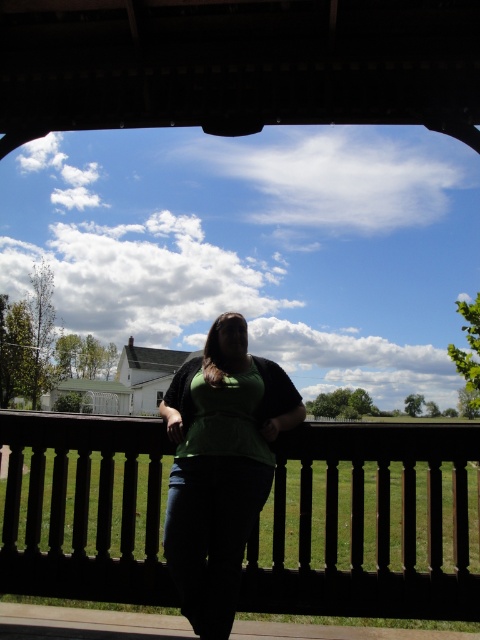
Is dark brown wooden porch at center above green matte shirt at center?

Incorrect, dark brown wooden porch at center is not positioned above green matte shirt at center.

Between dark brown wooden porch at center and green matte shirt at center, which one has more height?

With more height is green matte shirt at center.

Between point (107, 593) and point (203, 476), which one is positioned in front?

Point (203, 476)

Identify the location of dark brown wooden porch at center. Image resolution: width=480 pixels, height=640 pixels. (367, 525).